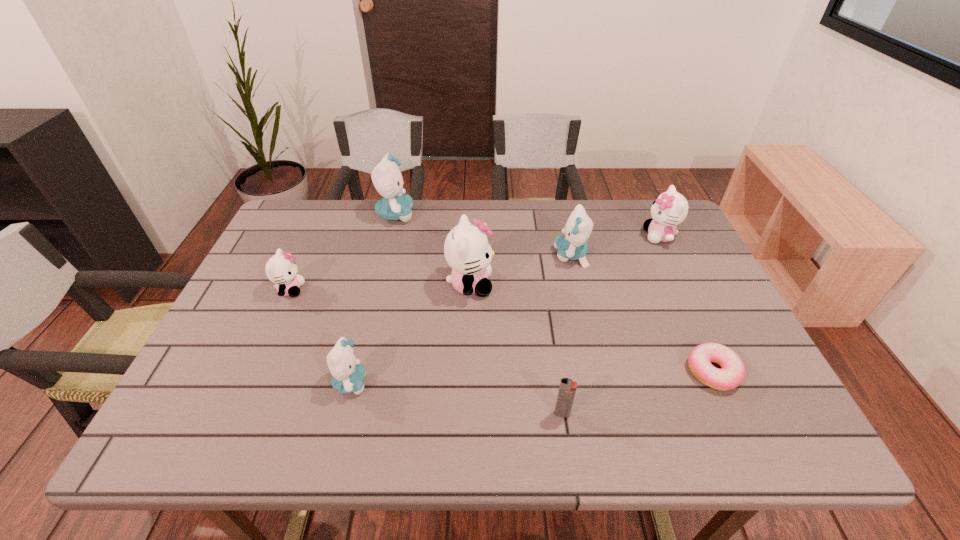
Locate an element on the screen. The image size is (960, 540). the farthest blue kitten is located at coordinates (396, 205).

Where is `the fifth object from right to left`? The image size is (960, 540). the fifth object from right to left is located at coordinates (467, 250).

You are a GUI agent. You are given a task and a screenshot of the screen. Output one action in this format:
    pyautogui.click(x=<x>, y=<y>)
    Task: Click on the biggest white kitten
    
    Given the screenshot: What is the action you would take?
    pyautogui.click(x=467, y=250)

The height and width of the screenshot is (540, 960). What are the coordinates of `the third object from right to left` in the screenshot? It's located at (572, 246).

Identify the location of the second nearest blue kitten. The width and height of the screenshot is (960, 540). (572, 246).

Find the location of a particular element. The image size is (960, 540). the farthest white kitten is located at coordinates (670, 209).

This screenshot has height=540, width=960. I want to click on the rightmost kitten, so click(670, 209).

Locate an element on the screen. the leftmost kitten is located at coordinates [281, 269].

I want to click on the smallest white kitten, so click(x=281, y=269).

The image size is (960, 540). I want to click on the nearest kitten, so click(x=347, y=373).